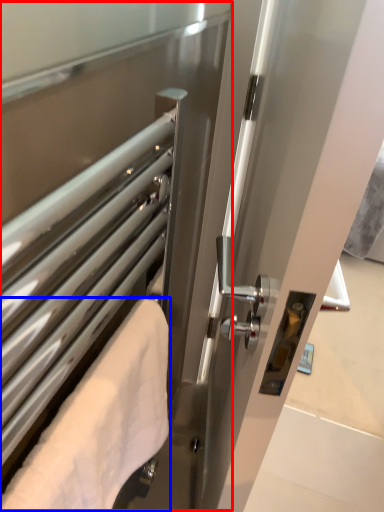
Question: Which of the following is the farthest to the observer, screen door (highlighted by a red box) or towel (highlighted by a blue box)?

Choices:
 (A) screen door
 (B) towel

Answer: (B)